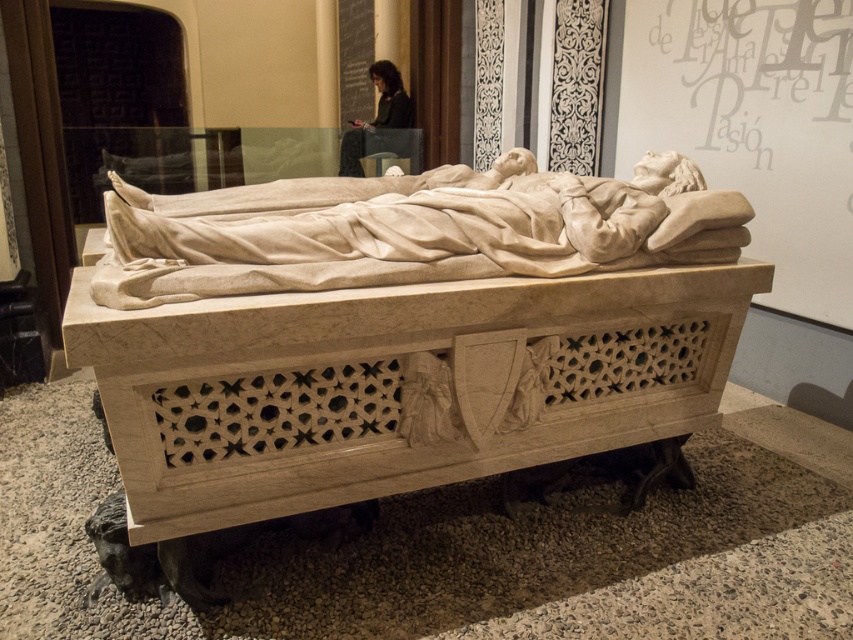
Is white marble statue at center wider than dark hair person at upper center?

Correct, the width of white marble statue at center exceeds that of dark hair person at upper center.

Between white marble statue at center and dark hair person at upper center, which one appears on the left side from the viewer's perspective?

dark hair person at upper center

Between point (219, 243) and point (399, 128), which one is positioned behind?

Point (399, 128)

This screenshot has height=640, width=853. Find the location of `white marble statue at center`. white marble statue at center is located at coordinates (416, 218).

Between point (306, 330) and point (381, 122), which one is positioned behind?

The point (381, 122) is more distant.

Is white marble bed at center to the left of dark hair person at upper center from the viewer's perspective?

No, white marble bed at center is not to the left of dark hair person at upper center.

Who is more forward, (430, 362) or (410, 113)?

Point (430, 362) is more forward.

Locate an element on the screen. The height and width of the screenshot is (640, 853). white marble bed at center is located at coordinates (403, 332).

Image resolution: width=853 pixels, height=640 pixels. I want to click on white marble bed at center, so click(403, 332).

Where is `white marble bed at center`? The height and width of the screenshot is (640, 853). white marble bed at center is located at coordinates (403, 332).